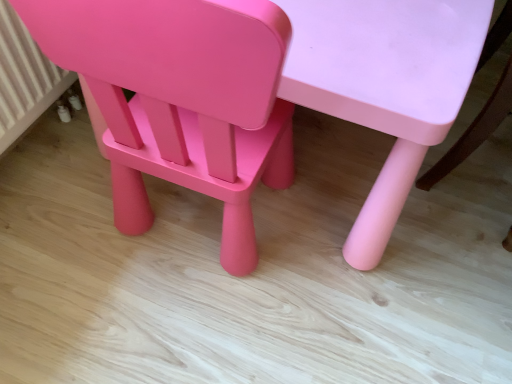
The image size is (512, 384). In order to click on free region under matte plastic chair at center (from a real-world perspective) in this screenshot , I will do `click(187, 222)`.